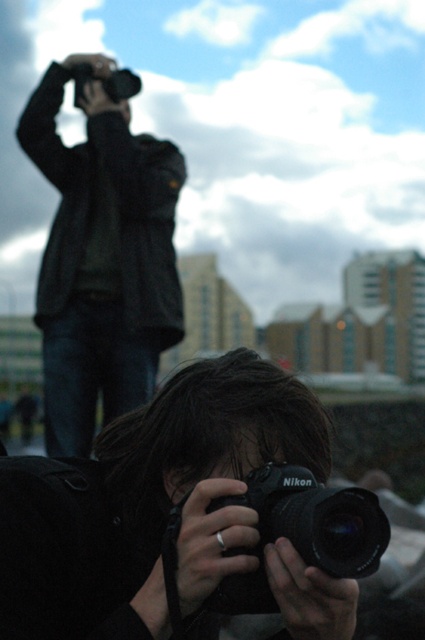
Question: Can you confirm if dark gray jacket at upper left is positioned above matte black camera at upper left?

Choices:
 (A) yes
 (B) no

Answer: (B)

Question: Which point is closer to the camera?

Choices:
 (A) (295, 508)
 (B) (133, 96)
 (C) (172, 289)

Answer: (A)

Question: Is black matte nikon camera at center further to the viewer compared to matte black camera at upper left?

Choices:
 (A) yes
 (B) no

Answer: (B)

Question: Among these objects, which one is farthest from the camera?

Choices:
 (A) black matte nikon camera at center
 (B) matte black camera at upper left
 (C) dark gray jacket at upper left

Answer: (B)

Question: Which of these objects is positioned closest to the black matte nikon camera at center?

Choices:
 (A) matte black camera at upper left
 (B) dark gray jacket at upper left

Answer: (B)

Question: Is dark gray jacket at upper left below black matte nikon camera at center?

Choices:
 (A) no
 (B) yes

Answer: (A)